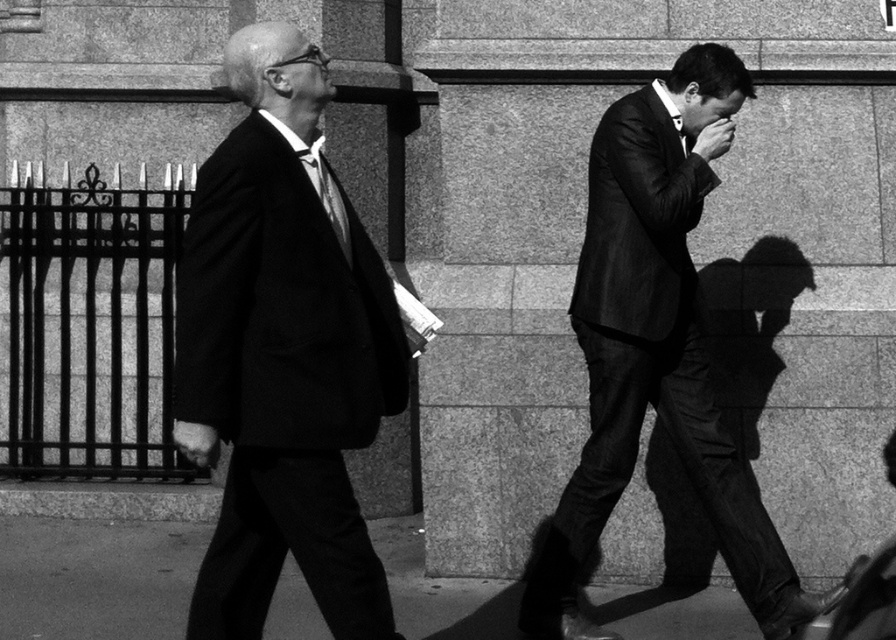
Does matte black suit at left have a smaller size compared to silky satin tie at center?

Actually, matte black suit at left might be larger than silky satin tie at center.

Which is behind, point (231, 602) or point (336, 205)?

Point (231, 602)

The image size is (896, 640). What do you see at coordinates (282, 355) in the screenshot?
I see `matte black suit at left` at bounding box center [282, 355].

Image resolution: width=896 pixels, height=640 pixels. What are the coordinates of `matte black suit at left` in the screenshot? It's located at (282, 355).

Is matte black suit at left shorter than smooth black suit at center?

Correct, matte black suit at left is not as tall as smooth black suit at center.

Is point (355, 276) farther from viewer compared to point (694, 404)?

No, it is not.

The height and width of the screenshot is (640, 896). In order to click on matte black suit at left in this screenshot , I will do `click(282, 355)`.

Is smooth black suit at center bigger than smooth concrete pavement at lower center?

Correct, smooth black suit at center is larger in size than smooth concrete pavement at lower center.

Between smooth black suit at center and smooth concrete pavement at lower center, which one is positioned higher?

Positioned higher is smooth black suit at center.

At what (x,y) coordinates should I click in order to perform the action: click on smooth black suit at center. Please return your answer as a coordinate pair (x, y). The width and height of the screenshot is (896, 640). Looking at the image, I should click on (651, 362).

This screenshot has height=640, width=896. I want to click on smooth black suit at center, so click(651, 362).